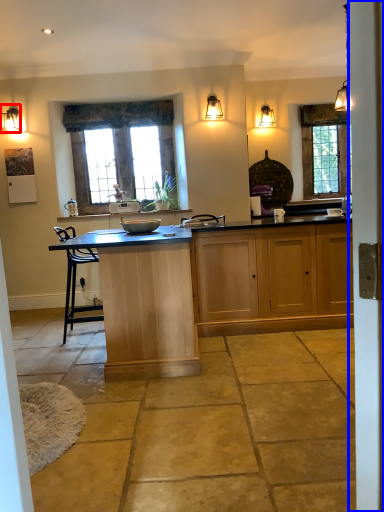
Question: Which of the following is the closest to the observer, lamp (highlighted by a red box) or screen door (highlighted by a blue box)?

Choices:
 (A) lamp
 (B) screen door

Answer: (B)